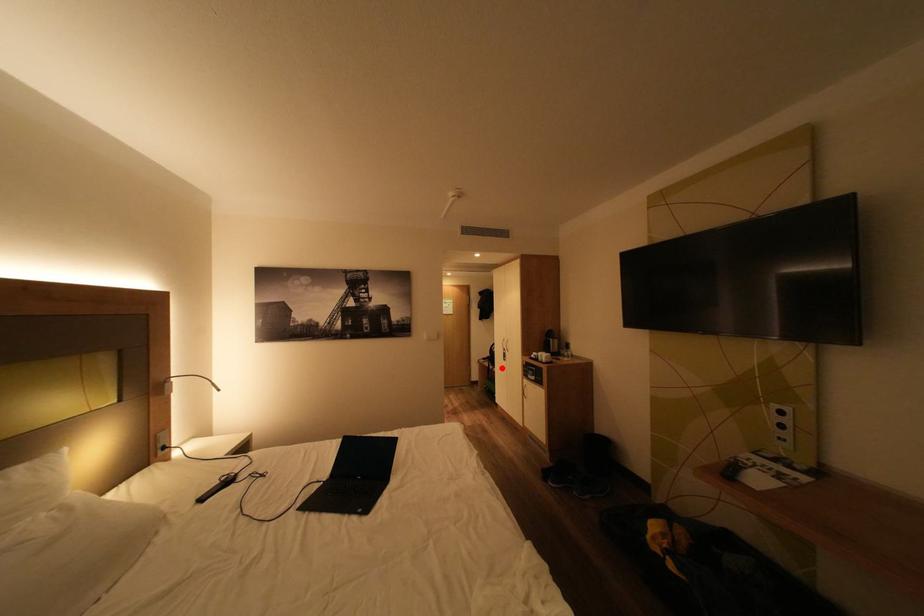
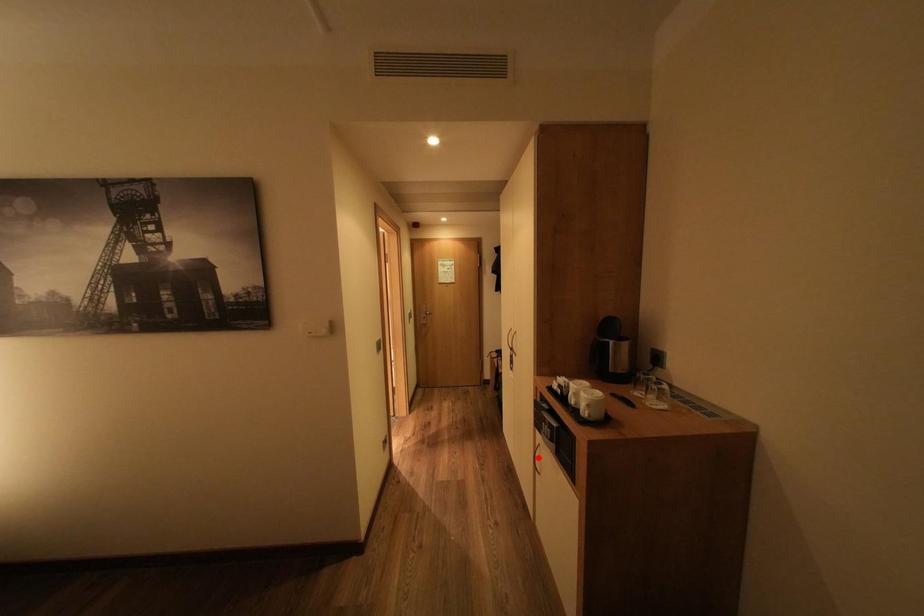
I am providing you with two images of the same scene from different viewpoints. A red point is marked on the first image and another point is marked on the second image. Do the highlighted points in image1 and image2 indicate the same real-world spot?

No